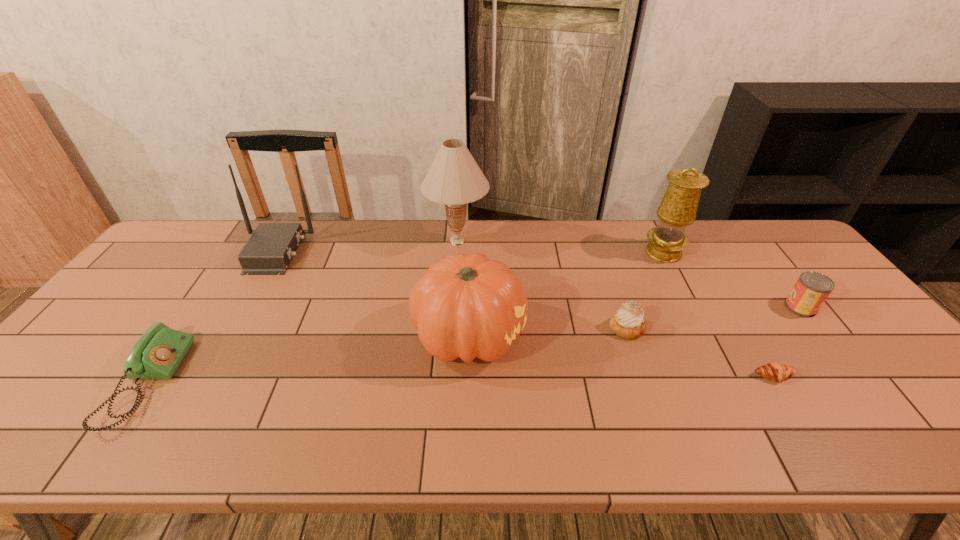
Where is `vacant space that's between the fifth object from left to right and the telephone`? vacant space that's between the fifth object from left to right and the telephone is located at coordinates (387, 355).

Locate an element on the screen. Image resolution: width=960 pixels, height=540 pixels. free area in between the telephone and the pumpkin is located at coordinates (308, 360).

Locate an element on the screen. This screenshot has width=960, height=540. empty space between the oil lamp and the fifth tallest object is located at coordinates (732, 280).

Image resolution: width=960 pixels, height=540 pixels. In order to click on free space between the left pastry and the oil lamp in this screenshot , I will do `click(645, 290)`.

Locate an element on the screen. Image resolution: width=960 pixels, height=540 pixels. free space between the oil lamp and the lampshade is located at coordinates (561, 246).

Identify the location of free point between the oil lamp and the can. (732, 280).

Select which object appears as the closest to the router. Please provide its 2D coordinates. Your answer should be formatted as a tuple, i.e. [(x, y)], where the tuple contains the x and y coordinates of a point satisfying the conditions above.

[(158, 353)]

This screenshot has height=540, width=960. What are the coordinates of `object that can be found as the third closest to the telephone` in the screenshot? It's located at (454, 178).

Find the location of a particular element. This screenshot has width=960, height=540. free spot that satisfies the following two spatial constraints: 1. on the front side of the oil lamp; 2. on the left side of the fourth shortest object is located at coordinates (691, 307).